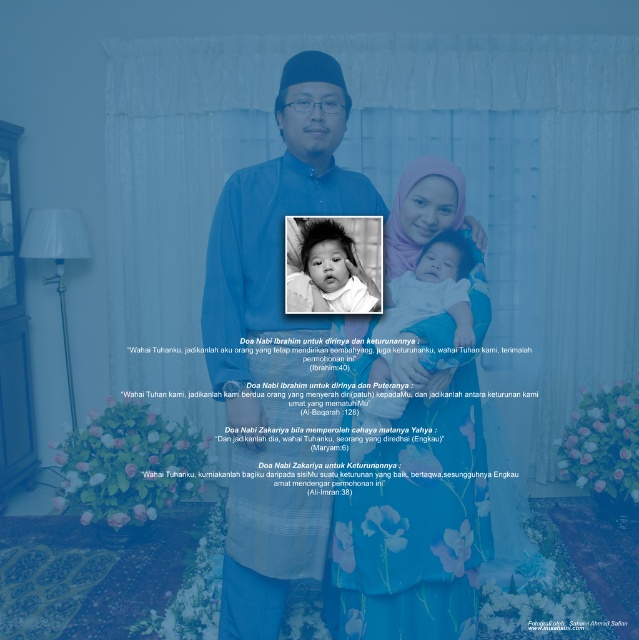
From the picture: In the family portrait, you notice the matte blue shirt at center and the black and white baby at center. Which object is taller?

The matte blue shirt at center is taller than the black and white baby at center.

Where is the matte blue shirt at center located in the image?

The matte blue shirt at center is located at point 0.555 on the x axis and 0.435 on the y axis.

In the family portrait, you notice the matte blue shirt at center and the matte purple hijab at center. Which one appears taller in the image?

The matte blue shirt at center is taller than the matte purple hijab at center.